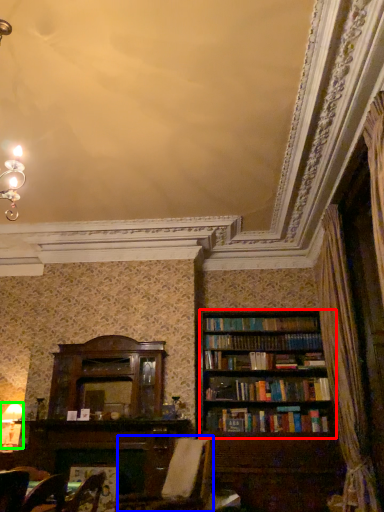
Question: Estimate the real-world distances between objects in this image. Which object is farther from bookcase (highlighted by a red box), swivel chair (highlighted by a blue box) or lamp (highlighted by a green box)?

Choices:
 (A) swivel chair
 (B) lamp

Answer: (B)